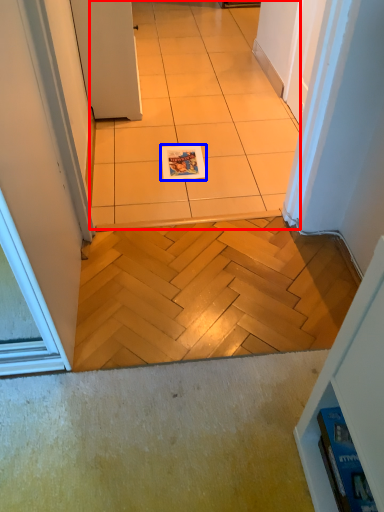
Question: Which of the following is the farthest to the observer, ceramic tile (highlighted by a red box) or magazine (highlighted by a blue box)?

Choices:
 (A) ceramic tile
 (B) magazine

Answer: (B)